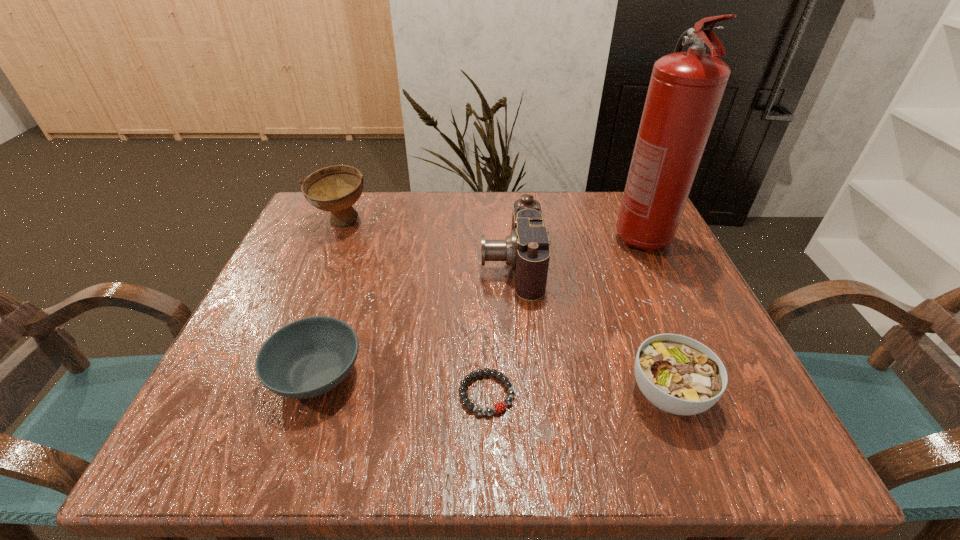
Identify the location of fire extinguisher. (686, 88).

I want to click on the farthest soup bowl, so click(x=334, y=189).

At what (x,y) coordinates should I click in order to perform the action: click on camera. Please return your answer as a coordinate pair (x, y). The width and height of the screenshot is (960, 540). Looking at the image, I should click on (526, 250).

I want to click on the rightmost soup bowl, so click(x=679, y=375).

This screenshot has height=540, width=960. I want to click on the fourth tallest object, so click(679, 375).

This screenshot has width=960, height=540. In order to click on the shortest soup bowl in this screenshot , I will do `click(309, 357)`.

The width and height of the screenshot is (960, 540). I want to click on bracelet, so click(x=498, y=407).

This screenshot has width=960, height=540. In order to click on vacant space located 0.180m on the handle side the fire extinguisher in this screenshot , I will do `click(682, 326)`.

In order to click on free region located on the right of the tallest soup bowl in this screenshot , I will do `click(400, 222)`.

This screenshot has width=960, height=540. Find the location of `free space located 0.250m on the front-facing side of the camera`. free space located 0.250m on the front-facing side of the camera is located at coordinates (366, 264).